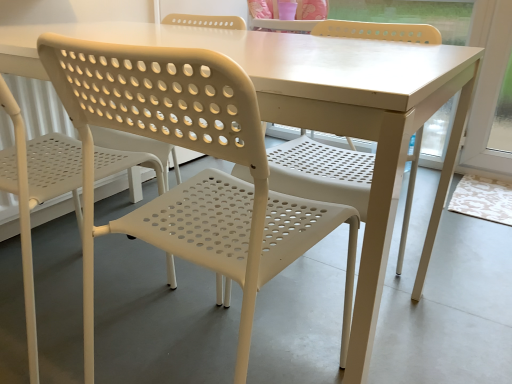
Question: Considering the positions of white plastic chair at left, the 1th chair in the left-to-right sequence, and white plastic chair at center, which appears as the first chair when viewed from the right, in the image, is white plastic chair at left, the 1th chair in the left-to-right sequence, bigger or smaller than white plastic chair at center, which appears as the first chair when viewed from the right,?

Choices:
 (A) small
 (B) big

Answer: (B)

Question: From the image's perspective, is white plastic chair at left, the 1th chair in the left-to-right sequence, above or below white plastic chair at center, the second chair in the left-to-right sequence?

Choices:
 (A) above
 (B) below

Answer: (A)

Question: From a real-world perspective, is white plastic chair at left, the 2th chair when ordered from right to left, physically located above or below white plastic chair at center, the second chair in the left-to-right sequence?

Choices:
 (A) below
 (B) above

Answer: (A)

Question: In terms of width, does white plastic chair at center, the second chair in the left-to-right sequence, look wider or thinner when compared to white plastic chair at left, the 1th chair in the left-to-right sequence?

Choices:
 (A) thin
 (B) wide

Answer: (A)

Question: From a real-world perspective, is white plastic chair at center, which appears as the first chair when viewed from the right, physically located above or below white plastic chair at left, the 2th chair when ordered from right to left?

Choices:
 (A) above
 (B) below

Answer: (A)

Question: In terms of height, does white plastic chair at center, which appears as the first chair when viewed from the right, look taller or shorter compared to white plastic chair at left, the 2th chair when ordered from right to left?

Choices:
 (A) short
 (B) tall

Answer: (A)

Question: In the image, is white plastic chair at center, the second chair in the left-to-right sequence, on the left side or the right side of white plastic chair at left, the 1th chair in the left-to-right sequence?

Choices:
 (A) left
 (B) right

Answer: (B)